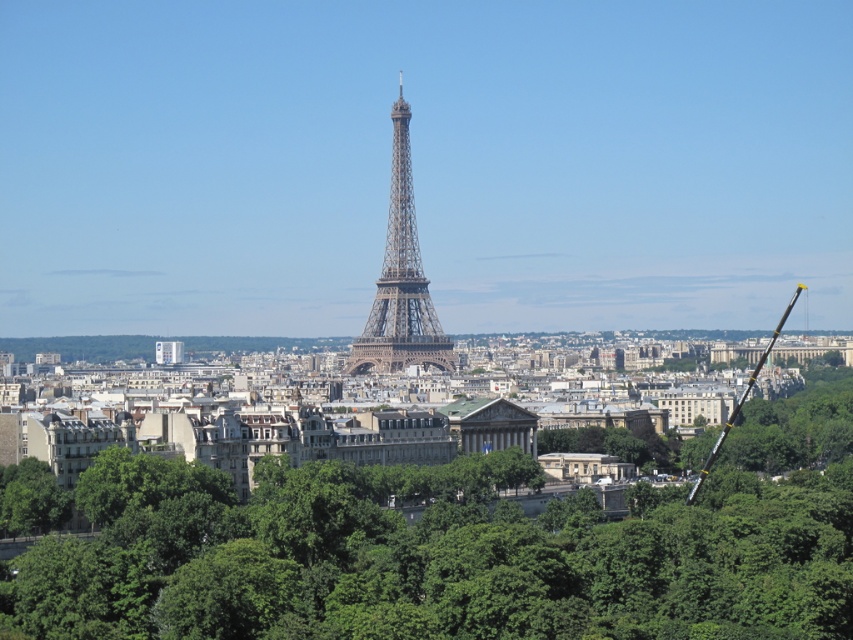
Can you confirm if green leafy tree at center is taller than metallic lattice tower at center?

In fact, green leafy tree at center may be shorter than metallic lattice tower at center.

Is green leafy tree at center thinner than metallic lattice tower at center?

No, green leafy tree at center is not thinner than metallic lattice tower at center.

Is point (85, 563) positioned in front of point (426, 323)?

That is True.

The width and height of the screenshot is (853, 640). Find the location of `green leafy tree at center`. green leafy tree at center is located at coordinates (457, 547).